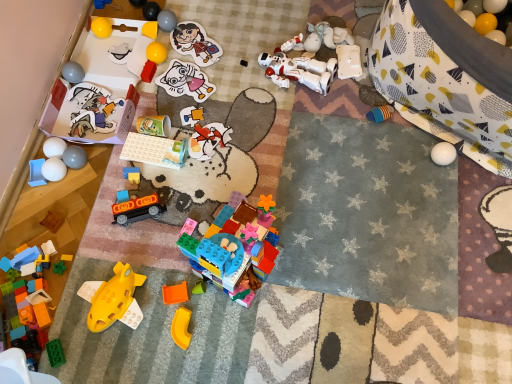
Locate an element on the screen. This screenshot has width=512, height=384. vacant space that is in between matte paper sticker at upper center, which is counted as the twentieth toy, starting from the left, and matte blue plastic toy at center, marked as the thirteenth toy in a right-to-left arrangement is located at coordinates (173, 96).